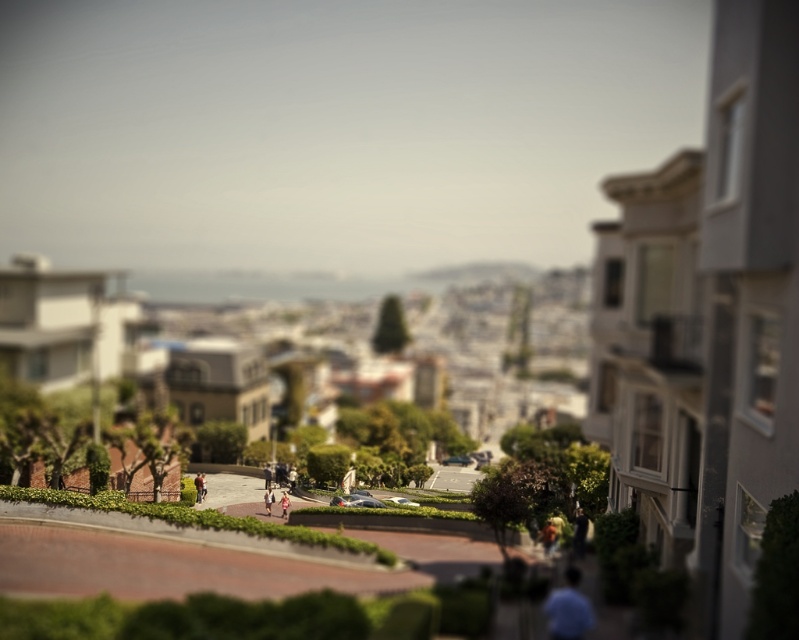
You are a photographer standing in the middle of the curved road and want to take a photo of the red shirt at center and pink fabric dress at center. Which clothing item would appear wider in the photo?

The red shirt at center would appear wider in the photo since its width is larger than the pink fabric dress at center.

You are standing at the viewpoint looking at the hilly urban landscape. There are two points marked on the image, one at coordinates point (581, 536) and the other at point (264, 502). Which point is closer to you?

Point (581, 536) is closer to the camera than point (264, 502).

You are a photographer standing at the bottom of the curved road in the image. You want to take a photo that includes both the red shirt at center and the pink fabric dress at center. Since you can only focus on one subject at a time, which one should you focus on to ensure the other remains in the background?

You should focus on the red shirt at center because the pink fabric dress at center is behind it, so keeping the red shirt in focus will naturally place the pink fabric dress at center in the background.